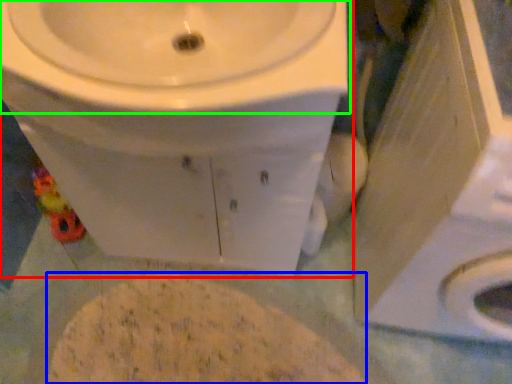
Question: Based on their relative distances, which object is nearer to toilet (highlighted by a red box)? Choose from flour (highlighted by a blue box) and sink (highlighted by a green box).

Choices:
 (A) flour
 (B) sink

Answer: (B)